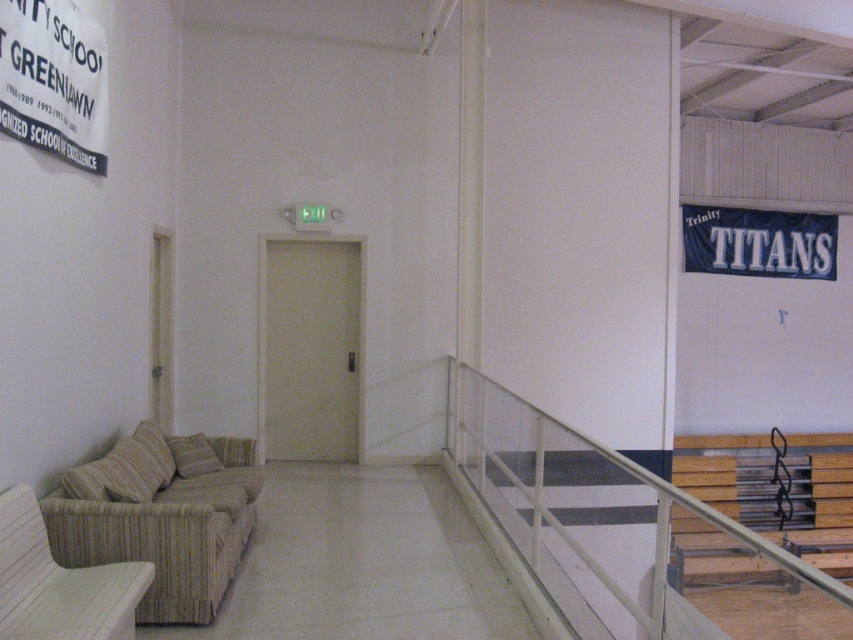
You are standing in the indoor space and want to know which of the two points, point (82, 488) or point (206, 449), is closer to you. Based on the scene description, can you determine which point is nearer?

Point (82, 488) is closer to the camera than point (206, 449), so it is nearer to you.

You are standing at the entrance of the indoor space and want to reach the white metal railing at upper right. According to the scene description, where should you look to find it?

The white metal railing at upper right is located at point 0.836 on the x axis and 0.735 on the y axis.